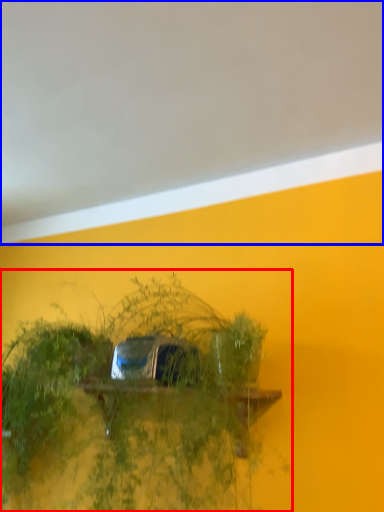
Question: Which object appears farthest to the camera in this image, houseplant (highlighted by a red box) or backdrop (highlighted by a blue box)?

Choices:
 (A) houseplant
 (B) backdrop

Answer: (A)